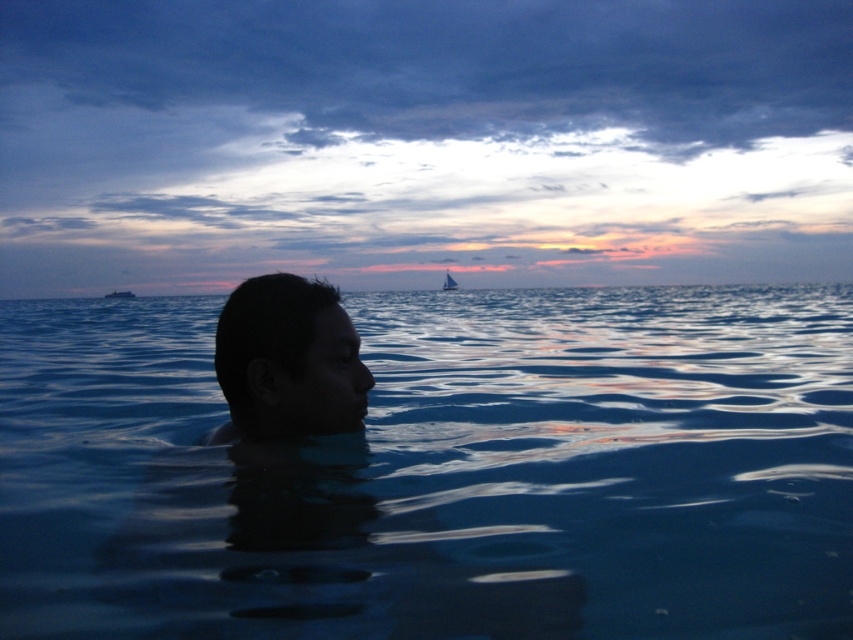
Between point (316, 385) and point (132, 296), which one is positioned behind?

The point (132, 296) is behind.

Is dark skin head at center closer to camera compared to white plastic boat at center?

Yes.

Is point (268, 419) positioned before point (112, 294)?

Yes, it is.

This screenshot has width=853, height=640. Find the location of `dark skin head at center`. dark skin head at center is located at coordinates (287, 362).

Can you confirm if white plastic boat at center is positioned below white sailboat at center?

Yes, white plastic boat at center is below white sailboat at center.

Is point (119, 298) closer to viewer compared to point (447, 275)?

Yes, it is.

Where is `white plastic boat at center`? white plastic boat at center is located at coordinates (119, 294).

Between dark skin head at center and white sailboat at center, which one is positioned higher?

Positioned higher is white sailboat at center.

Who is positioned more to the left, dark skin head at center or white sailboat at center?

dark skin head at center

The width and height of the screenshot is (853, 640). What do you see at coordinates (287, 362) in the screenshot? I see `dark skin head at center` at bounding box center [287, 362].

Identify the location of dark skin head at center. (287, 362).